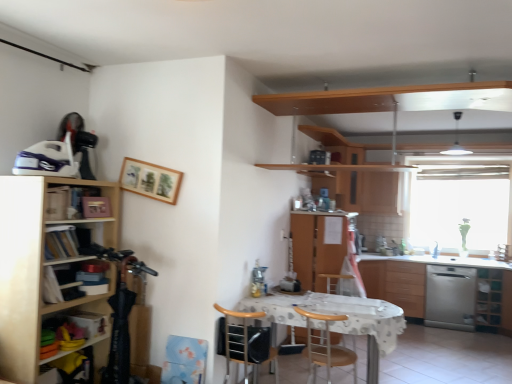
Question: Is brown wood chair at center, the 2th chair from the left, next to green glass cabinet at lower right, the second cabinet from the left?

Choices:
 (A) yes
 (B) no

Answer: (B)

Question: From the image's perspective, would you say brown wood chair at center, marked as the first chair in a right-to-left arrangement, is positioned over green glass cabinet at lower right, arranged as the 1th cabinet when viewed from the right?

Choices:
 (A) no
 (B) yes

Answer: (B)

Question: Is brown wood chair at center, marked as the first chair in a right-to-left arrangement, facing towards green glass cabinet at lower right, which appears as the 2th cabinet when viewed from the front?

Choices:
 (A) no
 (B) yes

Answer: (A)

Question: Is brown wood chair at center, marked as the first chair in a right-to-left arrangement, located outside green glass cabinet at lower right, the 2th cabinet when ordered from top to bottom?

Choices:
 (A) no
 (B) yes

Answer: (B)

Question: Considering the relative positions of brown wood chair at center, the 2th chair from the left, and green glass cabinet at lower right, arranged as the 1th cabinet when viewed from the right, in the image provided, is brown wood chair at center, the 2th chair from the left, behind green glass cabinet at lower right, arranged as the 1th cabinet when viewed from the right,?

Choices:
 (A) no
 (B) yes

Answer: (A)

Question: Looking at the image, does transparent glass window at right seem bigger or smaller compared to brown wood cabinet at right, the 3th cabinetry when ordered from front to back?

Choices:
 (A) big
 (B) small

Answer: (A)

Question: From the image's perspective, is transparent glass window at right positioned above or below brown wood cabinet at right, arranged as the third cabinetry when viewed from the left?

Choices:
 (A) above
 (B) below

Answer: (A)

Question: Do you think transparent glass window at right is within brown wood cabinet at right, marked as the 1th cabinetry in a back-to-front arrangement, or outside of it?

Choices:
 (A) outside
 (B) inside

Answer: (A)

Question: From a real-world perspective, is transparent glass window at right positioned above or below brown wood cabinet at right, the 1th cabinetry from the right?

Choices:
 (A) below
 (B) above

Answer: (B)

Question: Relative to wooden picture frame at upper center, is light wood cabinet at left, positioned as the third cabinetry in right-to-left order, in front or behind?

Choices:
 (A) behind
 (B) front

Answer: (B)

Question: From the image's perspective, is light wood cabinet at left, marked as the first cabinetry in a front-to-back arrangement, positioned above or below wooden picture frame at upper center?

Choices:
 (A) below
 (B) above

Answer: (A)

Question: Considering the positions of light wood cabinet at left, the 3th cabinetry from the back, and wooden picture frame at upper center in the image, is light wood cabinet at left, the 3th cabinetry from the back, bigger or smaller than wooden picture frame at upper center?

Choices:
 (A) small
 (B) big

Answer: (B)

Question: In terms of width, does light wood cabinet at left, marked as the first cabinetry in a front-to-back arrangement, look wider or thinner when compared to wooden picture frame at upper center?

Choices:
 (A) thin
 (B) wide

Answer: (B)

Question: Is wooden chair at center, which is counted as the 1th chair, starting from the left, in front of or behind light wood cabinet at left, which is counted as the first cabinetry, starting from the left, in the image?

Choices:
 (A) behind
 (B) front

Answer: (A)

Question: In terms of size, does wooden chair at center, which is counted as the 1th chair, starting from the left, appear bigger or smaller than light wood cabinet at left, marked as the first cabinetry in a front-to-back arrangement?

Choices:
 (A) big
 (B) small

Answer: (B)